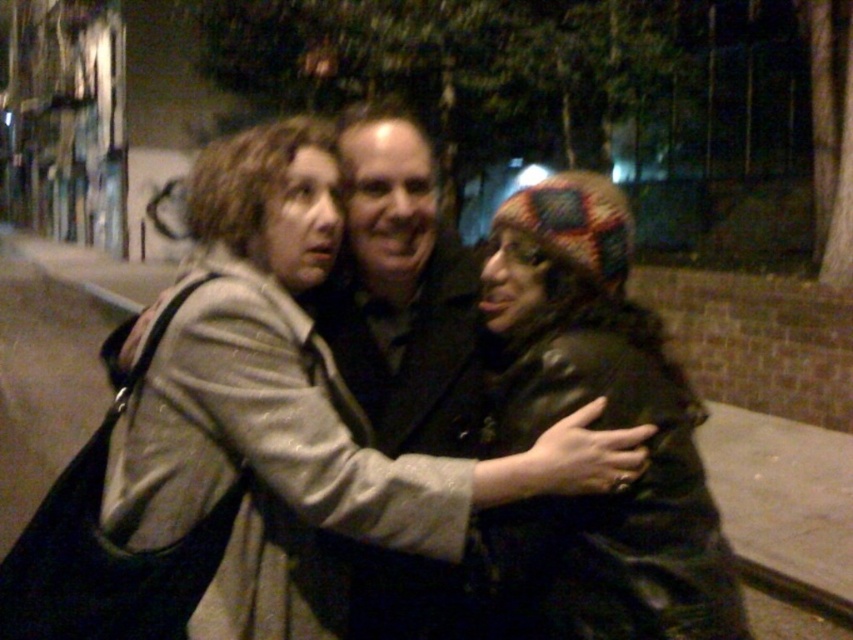
In the nighttime scene, there are two people wearing coats. One is wearing a matte gray coat at center and the other a black matte jacket at center. Which one is positioned more to the right?

The matte gray coat at center is positioned to the right of the black matte jacket at center, so the matte gray coat at center is more to the right.

You are a photographer trying to capture a candid shot of the two people at the center of the scene. The camera you are using has a depth of field that can focus on objects within a 10 inch range. Given the distance between the knitted multicolor hat at center and the black matte jacket at center, will both subjects be in focus in your photo?

The knitted multicolor hat at center and black matte jacket at center are 12.27 inches apart. Since the camera can only focus on objects within a 10 inch range, the distance between them exceeds the depth of field capability. Therefore, both subjects cannot be in focus simultaneously.

Based on the coordinates provided, which object corresponds to the point at (519, 406)?

The point at (519, 406) corresponds to the matte gray coat at center.